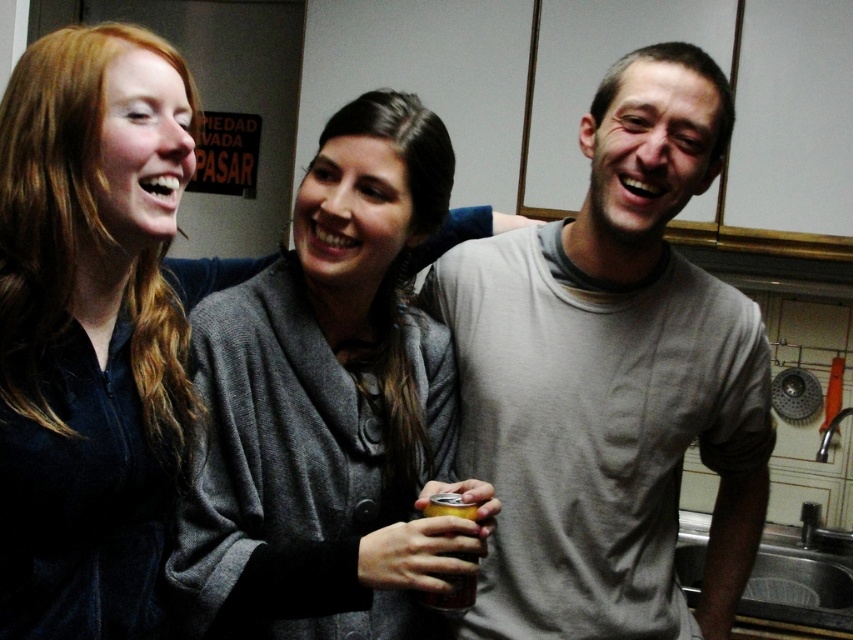
Question: Considering the relative positions of gray cotton t-shirt at center and velvet dark blue shirt at left in the image provided, where is gray cotton t-shirt at center located with respect to velvet dark blue shirt at left?

Choices:
 (A) right
 (B) left

Answer: (A)

Question: Which point is farther to the camera?

Choices:
 (A) velvet dark blue shirt at left
 (B) gray cotton t-shirt at center
 (C) gray wool sweater at center
 (D) metallic gold can at center

Answer: (B)

Question: Where is velvet dark blue shirt at left located in relation to metallic gold can at center in the image?

Choices:
 (A) right
 (B) left

Answer: (B)

Question: Estimate the real-world distances between objects in this image. Which object is closer to the velvet dark blue shirt at left?

Choices:
 (A) gray wool sweater at center
 (B) gray cotton t-shirt at center

Answer: (A)

Question: Which object appears closest to the camera in this image?

Choices:
 (A) gray cotton t-shirt at center
 (B) velvet dark blue shirt at left
 (C) gray wool sweater at center
 (D) metallic gold can at center

Answer: (B)

Question: Is velvet dark blue shirt at left thinner than metallic gold can at center?

Choices:
 (A) no
 (B) yes

Answer: (A)